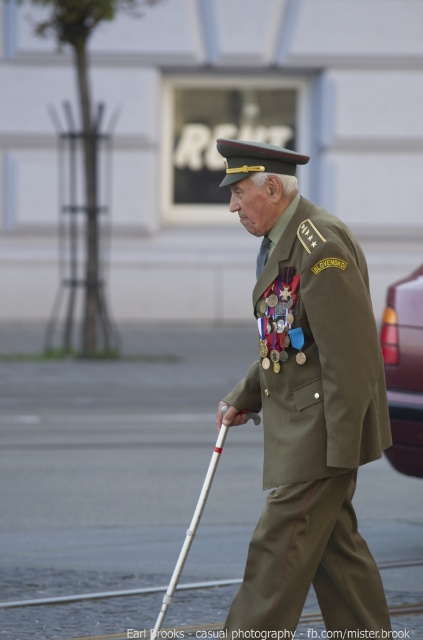
Question: Can you confirm if olive-green uniform at center is bigger than white plastic crutch at center?

Choices:
 (A) yes
 (B) no

Answer: (A)

Question: Is olive-green uniform at center positioned before white plastic crutch at center?

Choices:
 (A) no
 (B) yes

Answer: (A)

Question: Can you confirm if olive-green uniform at center is thinner than white plastic crutch at center?

Choices:
 (A) yes
 (B) no

Answer: (B)

Question: Among these objects, which one is farthest from the camera?

Choices:
 (A) olive-green uniform at center
 (B) white plastic crutch at center

Answer: (A)

Question: Which object is farther from the camera taking this photo?

Choices:
 (A) olive-green uniform at center
 (B) white plastic crutch at center

Answer: (A)

Question: Which point is closer to the camera?

Choices:
 (A) (173, 573)
 (B) (296, 317)

Answer: (B)